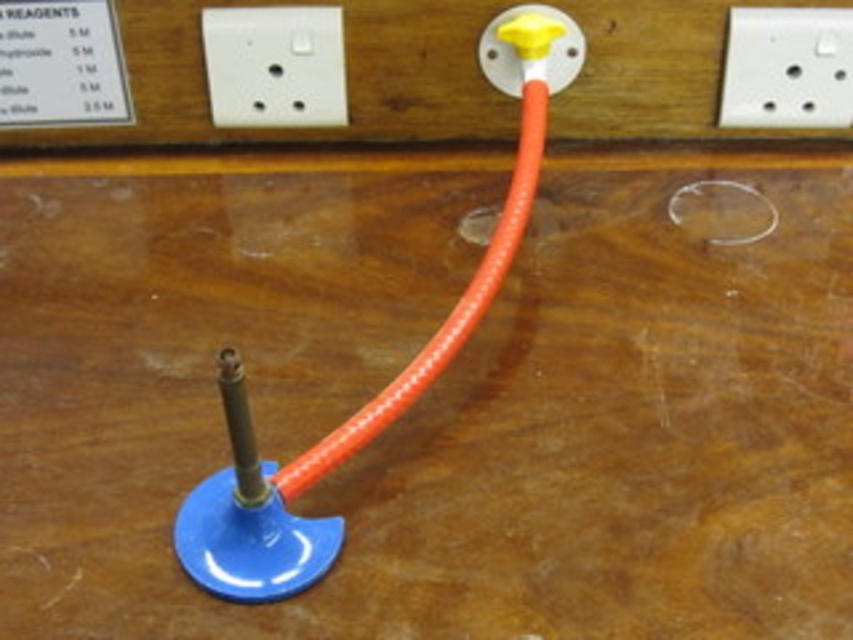
Can you confirm if white plastic socket at upper center is thinner than yellow plastic knob at upper center?

Incorrect, white plastic socket at upper center's width is not less than yellow plastic knob at upper center's.

Which is in front, point (222, 45) or point (505, 17)?

Point (505, 17)

The width and height of the screenshot is (853, 640). In order to click on white plastic socket at upper center in this screenshot , I will do `click(276, 67)`.

Is white plastic socket at upper center to the right of white plastic socket at upper right from the viewer's perspective?

Incorrect, white plastic socket at upper center is not on the right side of white plastic socket at upper right.

Is white plastic socket at upper center closer to camera compared to white plastic socket at upper right?

No, white plastic socket at upper center is further to the viewer.

Identify the location of white plastic socket at upper center. (276, 67).

Based on the photo, who is higher up, white plastic socket at upper right or yellow plastic knob at upper center?

yellow plastic knob at upper center is above.

How much distance is there between white plastic socket at upper right and yellow plastic knob at upper center?

white plastic socket at upper right and yellow plastic knob at upper center are 6.17 inches apart from each other.

Measure the distance between point (740, 13) and camera.

Point (740, 13) and camera are 1.00 meters apart from each other.

At what (x,y) coordinates should I click in order to perform the action: click on white plastic socket at upper right. Please return your answer as a coordinate pair (x, y). The height and width of the screenshot is (640, 853). Looking at the image, I should click on (787, 68).